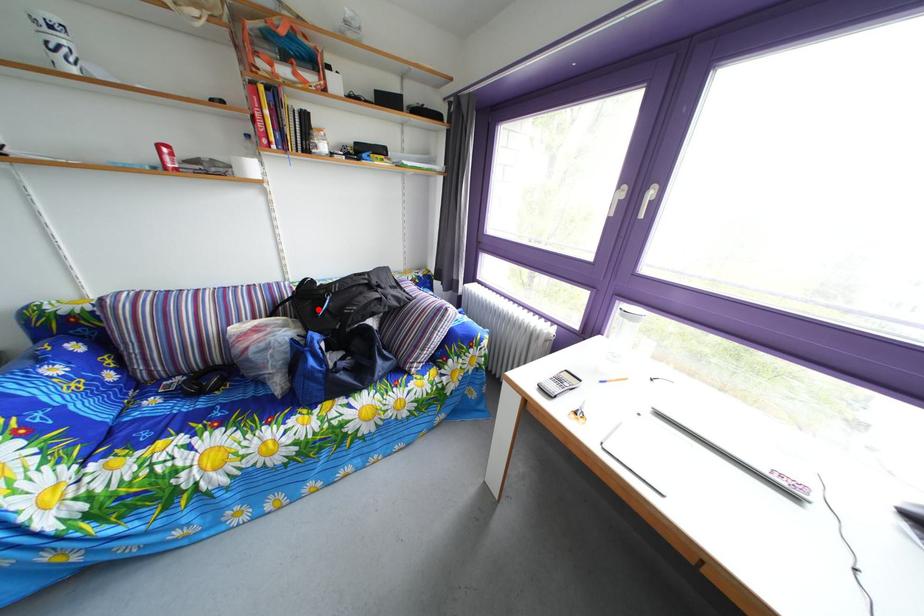
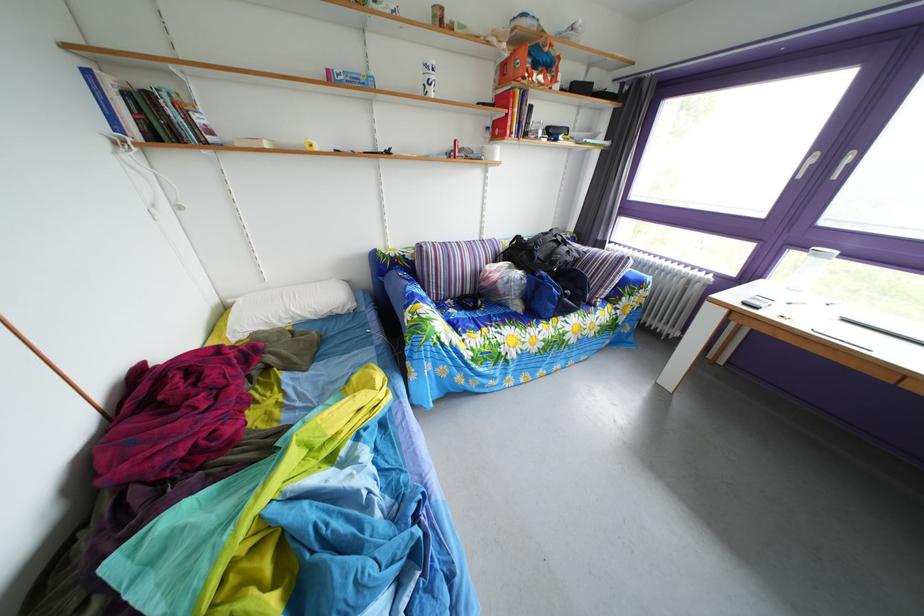
The point at the highlighted location is marked in the first image. Where is the corresponding point in the second image?

(529, 261)